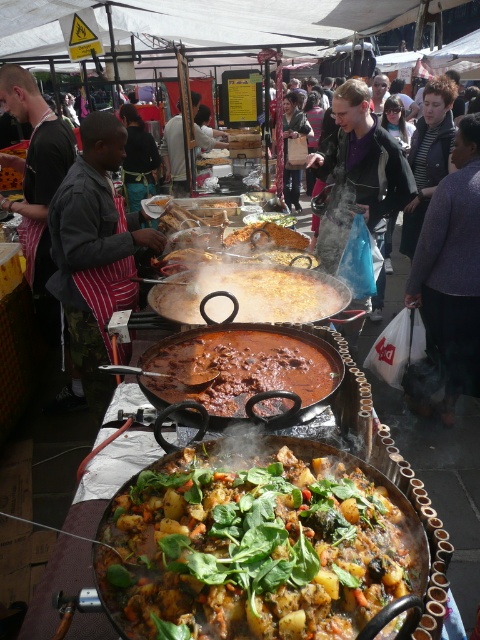
Does point (331, 449) lie in front of point (179, 132)?

Yes, point (331, 449) is closer to viewer.

Between green leafy vegetables at center and white fabric apron at center, which one is positioned lower?

Positioned lower is green leafy vegetables at center.

Who is more forward, (176, 602) or (171, 122)?

Point (176, 602) is more forward.

Image resolution: width=480 pixels, height=640 pixels. What are the coordinates of `green leafy vegetables at center` in the screenshot? It's located at [255, 547].

Is purple sweater at center to the right of brown matte pan at center from the viewer's perspective?

Indeed, purple sweater at center is positioned on the right side of brown matte pan at center.

In the scene shown: Who is shorter, purple sweater at center or brown matte pan at center?

With less height is brown matte pan at center.

Locate an element on the screen. The height and width of the screenshot is (640, 480). purple sweater at center is located at coordinates (452, 269).

This screenshot has width=480, height=640. Find the location of `purple sweater at center`. purple sweater at center is located at coordinates (452, 269).

Between point (94, 116) and point (193, 355), which one is positioned behind?

Positioned behind is point (94, 116).

Who is positioned more to the right, striped apron at left or brown matte stew at center?

From the viewer's perspective, brown matte stew at center appears more on the right side.

Who is more forward, (124,246) or (155,353)?

Point (155,353)

Locate an element on the screen. This screenshot has height=640, width=480. striped apron at left is located at coordinates (95, 252).